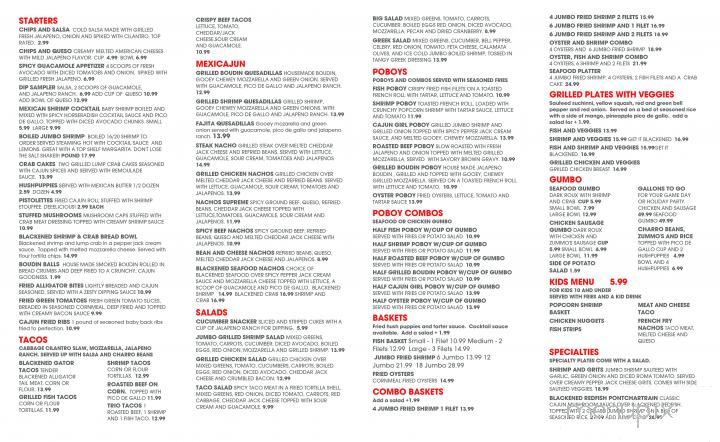
You are a GUI agent. You are given a task and a screenshot of the screen. Output one action in this format:
    pyautogui.click(x=<x>, y=<y>)
    Task: Click on the baskets
    
    Given the screenshot: What is the action you would take?
    pyautogui.click(x=396, y=319)